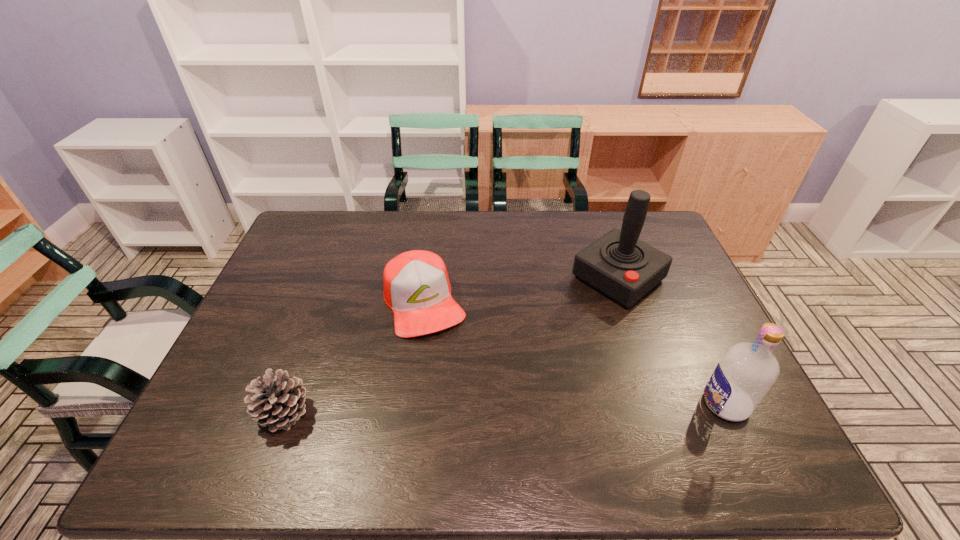
Identify the location of free space that is in between the baseball cap and the pinecone. (354, 357).

In order to click on vacant space in between the joystick and the vodka in this screenshot , I will do `click(672, 341)`.

Locate an element on the screen. The image size is (960, 540). vacant region between the leftmost object and the third object from right to left is located at coordinates (354, 357).

At what (x,y) coordinates should I click in order to perform the action: click on vacant area between the baseball cap and the joystick. Please return your answer as a coordinate pair (x, y). Image resolution: width=960 pixels, height=540 pixels. Looking at the image, I should click on (521, 290).

Identify the location of vacant area that lies between the leftmost object and the second object from left to right. Image resolution: width=960 pixels, height=540 pixels. (354, 357).

Identify the location of vacant region between the joystick and the pinecone. The width and height of the screenshot is (960, 540). (451, 345).

The width and height of the screenshot is (960, 540). I want to click on blank region between the third shortest object and the second object from left to right, so click(575, 353).

Select which object is the second closest to the joystick. Please provide its 2D coordinates. Your answer should be formatted as a tuple, i.e. [(x, y)], where the tuple contains the x and y coordinates of a point satisfying the conditions above.

[(416, 285)]

Identify which object is the second nearest to the vodka. Please provide its 2D coordinates. Your answer should be formatted as a tuple, i.e. [(x, y)], where the tuple contains the x and y coordinates of a point satisfying the conditions above.

[(416, 285)]

Locate an element on the screen. free space that satisfies the following two spatial constraints: 1. on the back side of the second tallest object; 2. on the label of the leftmost object is located at coordinates (287, 404).